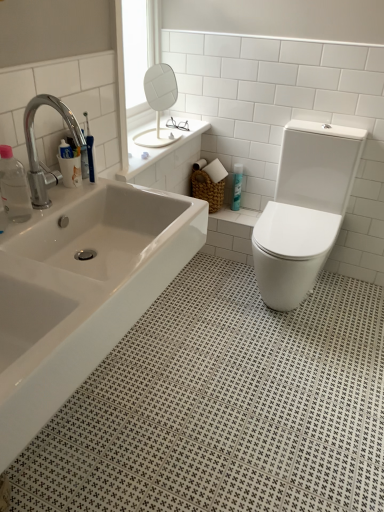
What are the coordinates of `free space underneath white glossy mirror at upper center (from a real-world perspective)` in the screenshot? It's located at (167, 138).